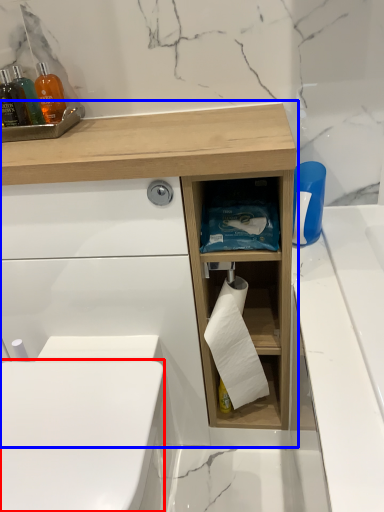
Question: Which object is further to the camera taking this photo, toilet bowl (highlighted by a red box) or bathroom cabinet (highlighted by a blue box)?

Choices:
 (A) toilet bowl
 (B) bathroom cabinet

Answer: (B)